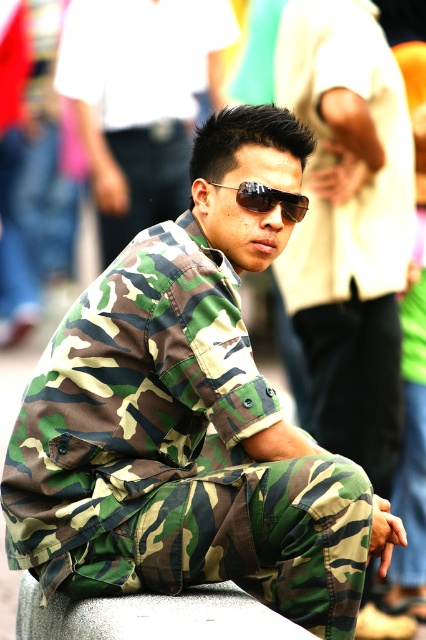
Is the position of camo fabric uniform at center more distant than that of sunglasses at center?

Yes, camo fabric uniform at center is further from the viewer.

Consider the image. Is camo fabric uniform at center to the left of sunglasses at center from the viewer's perspective?

No, camo fabric uniform at center is not to the left of sunglasses at center.

You are a GUI agent. You are given a task and a screenshot of the screen. Output one action in this format:
    pyautogui.click(x=<x>, y=<y>)
    Task: Click on the camo fabric uniform at center
    The image size is (426, 640).
    Given the screenshot: What is the action you would take?
    pyautogui.click(x=348, y=225)

Which is more to the right, camo fabric uniform at center or gray textured concrete at center?

Positioned to the right is camo fabric uniform at center.

Is camo fabric uniform at center to the right of gray textured concrete at center from the viewer's perspective?

Yes, camo fabric uniform at center is to the right of gray textured concrete at center.

Describe the element at coordinates (348, 225) in the screenshot. I see `camo fabric uniform at center` at that location.

Locate an element on the screen. The width and height of the screenshot is (426, 640). camo fabric uniform at center is located at coordinates (348, 225).

Can you confirm if camo fabric uniform at center is wider than camo fabric shirt at center?

In fact, camo fabric uniform at center might be narrower than camo fabric shirt at center.

What are the coordinates of `camo fabric uniform at center` in the screenshot? It's located at (348, 225).